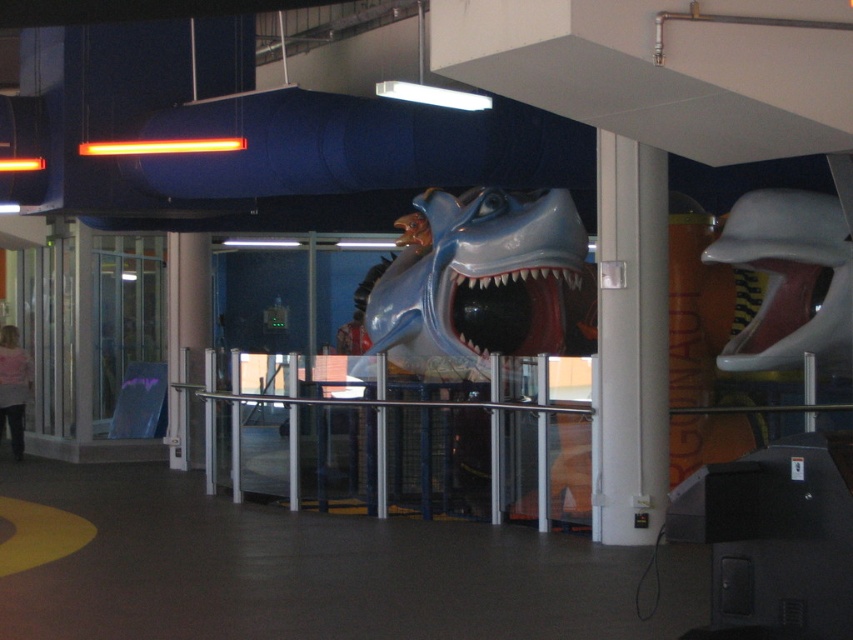
Question: Which object is the closest to the shiny blue plastic shark at center?

Choices:
 (A) white glossy pillar at center
 (B) shiny blue mouth at center

Answer: (B)

Question: Is shiny blue plastic shark at center to the left of white glossy pillar at center from the viewer's perspective?

Choices:
 (A) no
 (B) yes

Answer: (B)

Question: Among these objects, which one is farthest from the camera?

Choices:
 (A) shiny blue plastic shark at center
 (B) white glossy pillar at center
 (C) shiny blue mouth at center

Answer: (C)

Question: Considering the relative positions of shiny blue plastic shark at center and white glossy pillar at center in the image provided, where is shiny blue plastic shark at center located with respect to white glossy pillar at center?

Choices:
 (A) below
 (B) above

Answer: (B)

Question: Observing the image, what is the correct spatial positioning of white glossy pillar at center in reference to shiny blue mouth at center?

Choices:
 (A) right
 (B) left

Answer: (A)

Question: Considering the real-world distances, which object is farthest from the shiny blue plastic shark at center?

Choices:
 (A) shiny blue mouth at center
 (B) white glossy pillar at center

Answer: (B)